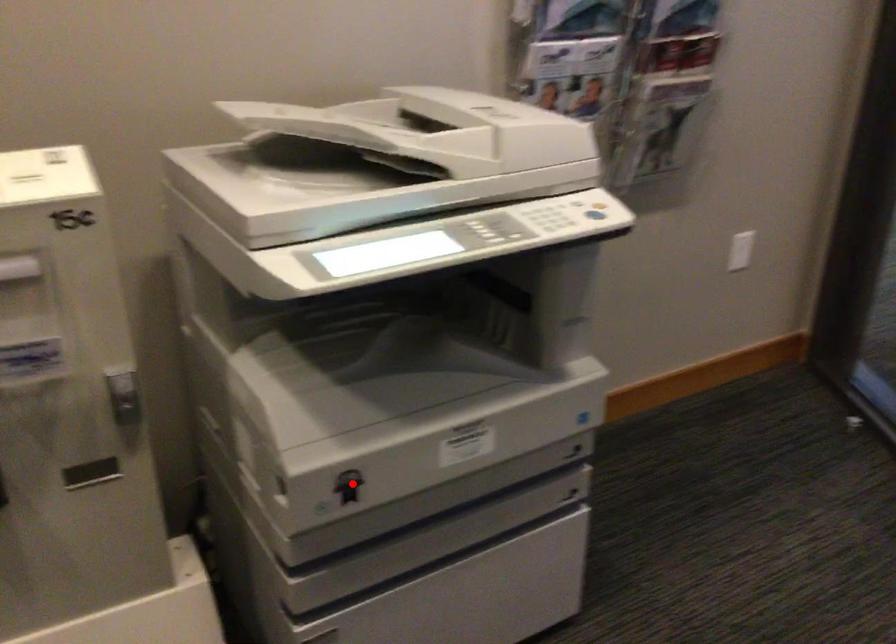
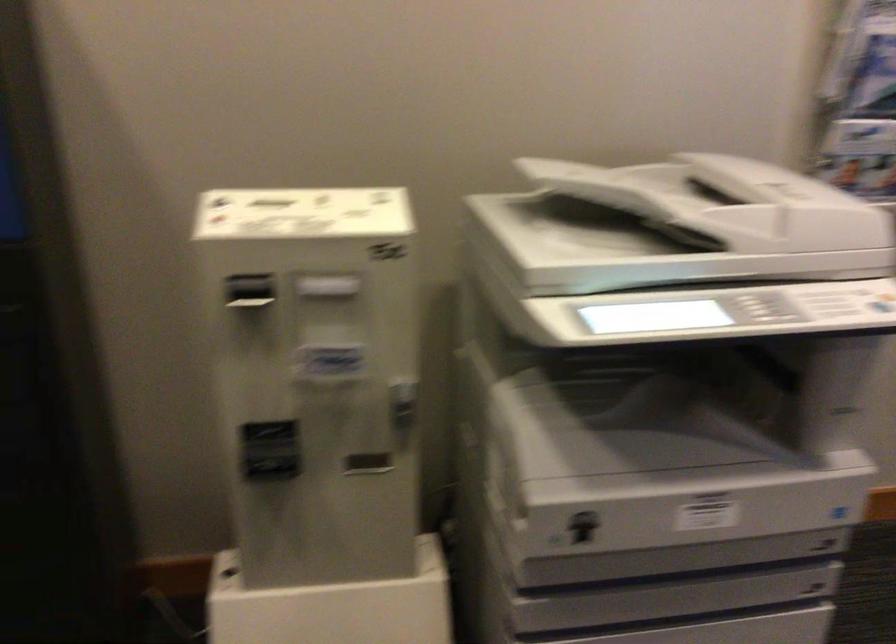
In the second image, find the point that corresponds to the highlighted location in the first image.

(582, 526)